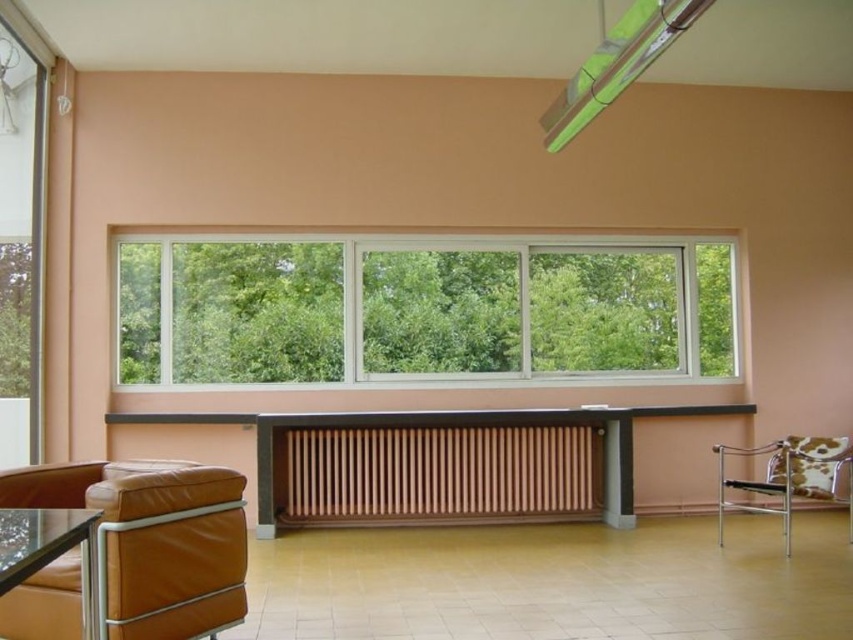
Question: Which point is closer to the camera?

Choices:
 (A) wooden slats radiator at center
 (B) brown leather couch at lower left

Answer: (B)

Question: Which point is farther to the camera?

Choices:
 (A) wooden slats radiator at center
 (B) clear glass window at center
 (C) cow print fabric chair at right

Answer: (B)

Question: Can you confirm if wooden slats radiator at center is smaller than transparent glass table at lower left?

Choices:
 (A) yes
 (B) no

Answer: (B)

Question: Is clear glass window at center behind brown leather couch at lower left?

Choices:
 (A) yes
 (B) no

Answer: (A)

Question: Which object appears farthest from the camera in this image?

Choices:
 (A) wooden slats radiator at center
 (B) transparent glass table at lower left
 (C) cow print fabric chair at right

Answer: (A)

Question: Does clear glass window at center appear on the right side of brown leather couch at lower left?

Choices:
 (A) no
 (B) yes

Answer: (B)